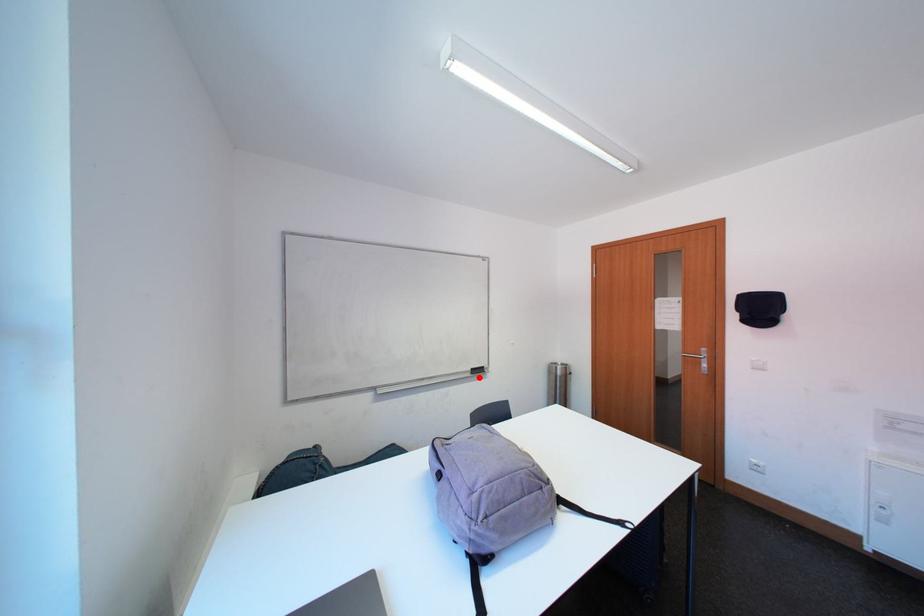
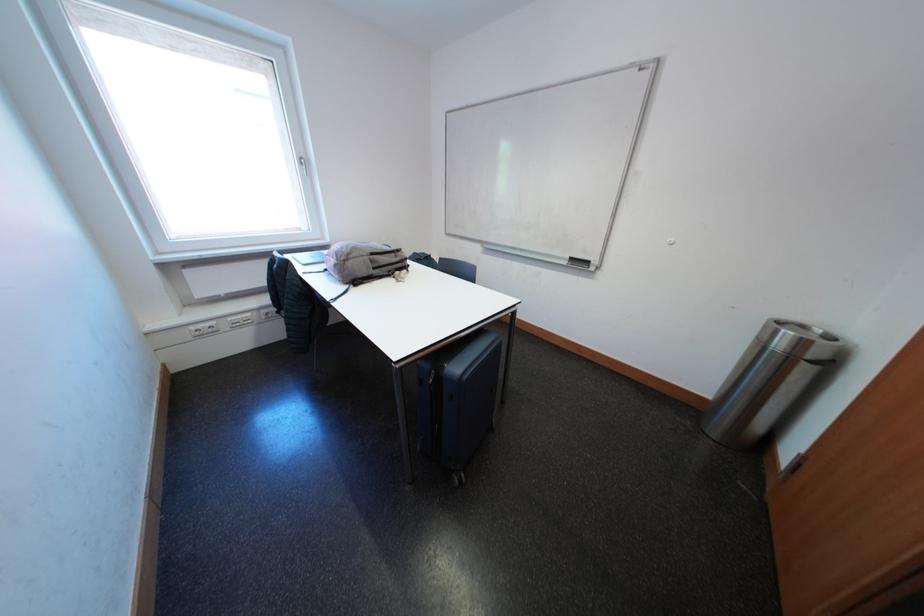
Question: I am providing you with two images of the same scene from different viewpoints. Given a red point in image1, look at the same physical point in image2. Is it:

Choices:
 (A) Closer to the viewpoint
 (B) Farther from the viewpoint

Answer: (A)